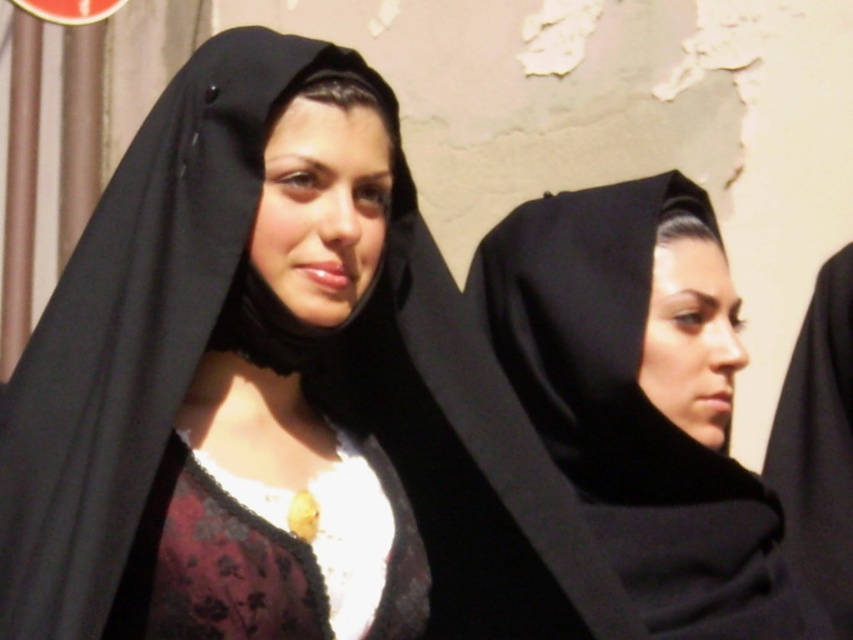
Question: Which of the following is the farthest from the observer?

Choices:
 (A) click(589, 429)
 (B) click(321, 566)
 (C) click(833, 416)

Answer: (C)

Question: Is black velvet headscarf at center smaller than black matte robe at right?

Choices:
 (A) no
 (B) yes

Answer: (A)

Question: Which of the following is the farthest from the observer?

Choices:
 (A) velvet-like burgundy dress at center
 (B) matte black headscarf at center

Answer: (A)

Question: Based on their relative distances, which object is farther from the black velvet headscarf at center?

Choices:
 (A) black matte robe at right
 (B) velvet-like burgundy dress at center

Answer: (B)

Question: Is black velvet headscarf at center thinner than black matte robe at right?

Choices:
 (A) yes
 (B) no

Answer: (B)

Question: Does matte black headscarf at center have a lesser width compared to velvet-like burgundy dress at center?

Choices:
 (A) no
 (B) yes

Answer: (A)